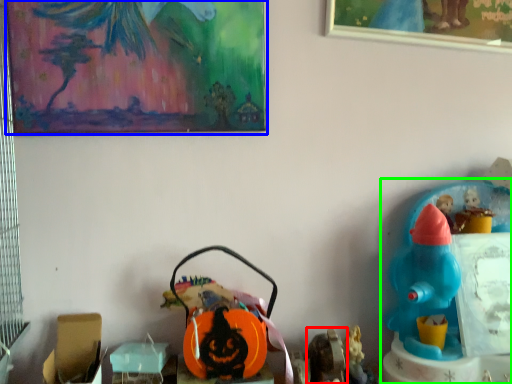
Question: Estimate the real-world distances between objects in this image. Which object is closer to toy (highlighted by a red box), picture frame (highlighted by a blue box) or toy (highlighted by a green box)?

Choices:
 (A) picture frame
 (B) toy

Answer: (B)